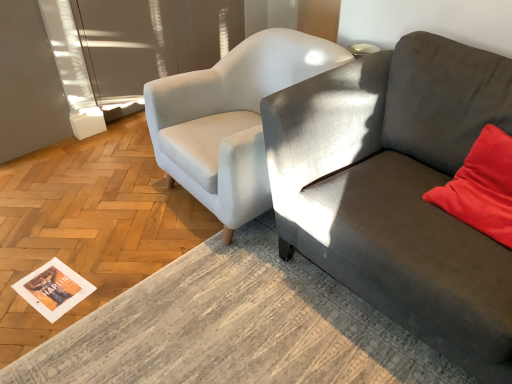
Locate an element on the screen. This screenshot has height=384, width=512. vacant space to the left of white paper magazine at lower left is located at coordinates (12, 277).